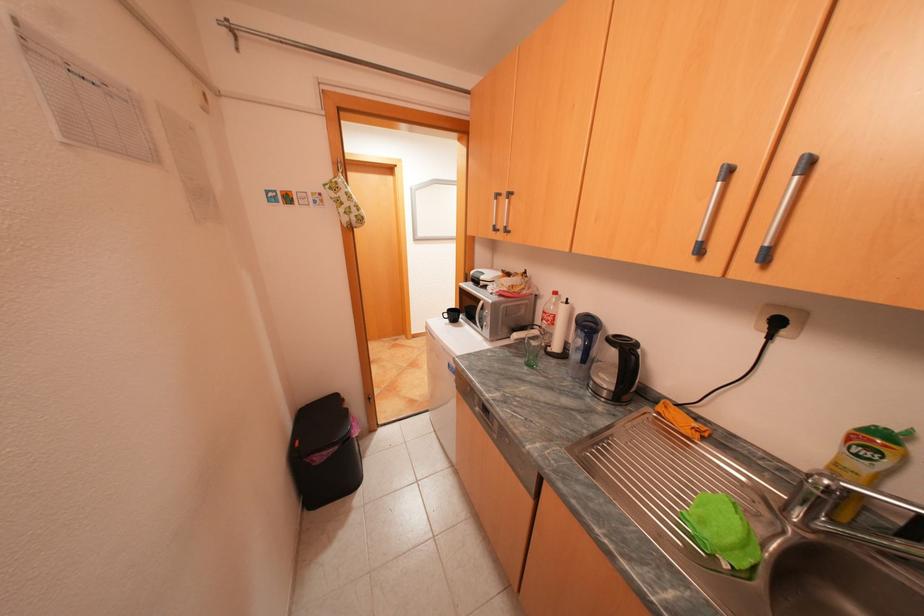
What do you see at coordinates (638, 362) in the screenshot?
I see `the black kettle handle` at bounding box center [638, 362].